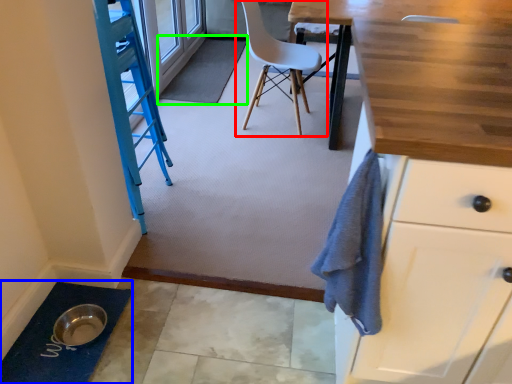
Question: Which object is the closest to the chair (highlighted by a red box)? Choose among these: bath mat (highlighted by a blue box) or bath mat (highlighted by a green box).

Choices:
 (A) bath mat
 (B) bath mat

Answer: (B)